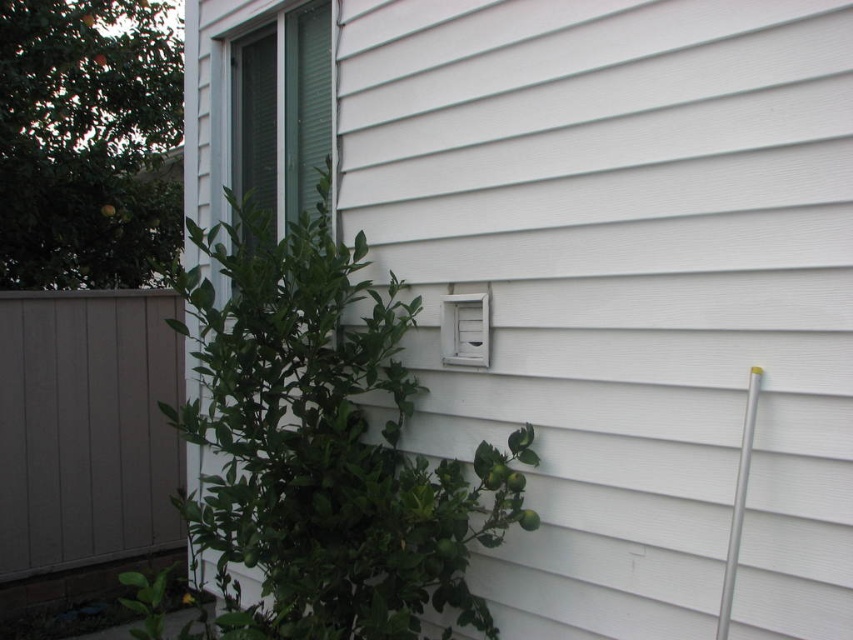
Can you confirm if green leafy plant at center is positioned to the right of silver metallic pole at right?

In fact, green leafy plant at center is to the left of silver metallic pole at right.

Which is below, green leafy plant at center or silver metallic pole at right?

green leafy plant at center is lower down.

What are the coordinates of `green leafy plant at center` in the screenshot? It's located at (x=323, y=445).

Is gray wood fence at left wider than silver metallic pole at right?

Indeed, gray wood fence at left has a greater width compared to silver metallic pole at right.

Can you confirm if gray wood fence at left is shorter than silver metallic pole at right?

In fact, gray wood fence at left may be taller than silver metallic pole at right.

Who is more forward, (83, 452) or (740, 440)?

Positioned in front is point (740, 440).

At what (x,y) coordinates should I click in order to perform the action: click on gray wood fence at left. Please return your answer as a coordinate pair (x, y). This screenshot has width=853, height=640. Looking at the image, I should click on (86, 428).

How much distance is there between green leafy plant at center and gray wood fence at left?

They are 2.69 meters apart.

Between green leafy plant at center and gray wood fence at left, which one appears on the left side from the viewer's perspective?

From the viewer's perspective, gray wood fence at left appears more on the left side.

Which is behind, point (463, 557) or point (91, 353)?

Positioned behind is point (91, 353).

I want to click on green leafy plant at center, so click(x=323, y=445).